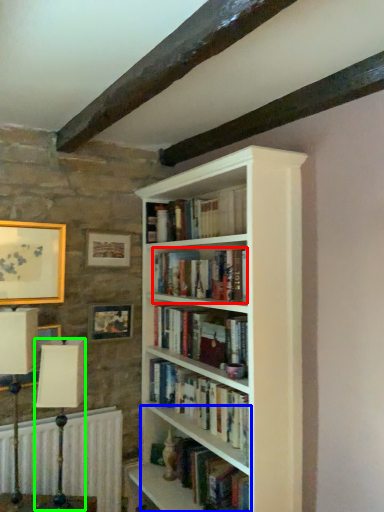
Question: Based on their relative distances, which object is nearer to book (highlighted by a red box)? Choose from shelf (highlighted by a blue box) and table lamp (highlighted by a green box).

Choices:
 (A) shelf
 (B) table lamp

Answer: (A)